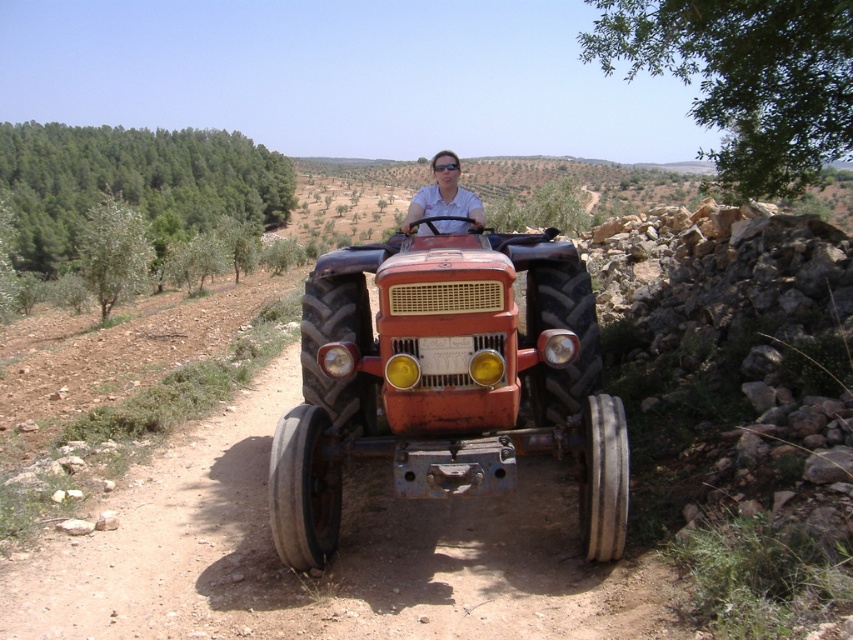
From the picture: Is rustic metal tractor at center smaller than matte white shirt at center?

No, rustic metal tractor at center is not smaller than matte white shirt at center.

Based on the photo, can you confirm if rustic metal tractor at center is positioned below matte white shirt at center?

Yes.

Locate an element on the screen. This screenshot has width=853, height=640. rustic metal tractor at center is located at coordinates (445, 384).

How much distance is there between dirt track at center and matte white shirt at center?

11.50 feet

Is dirt track at center positioned before matte white shirt at center?

Yes, dirt track at center is closer to the viewer.

Who is more distant from viewer, (527, 609) or (416, 205)?

Positioned behind is point (416, 205).

The height and width of the screenshot is (640, 853). I want to click on dirt track at center, so click(332, 557).

Can you confirm if dirt track at center is positioned to the left of rustic metal tractor at center?

Yes, dirt track at center is to the left of rustic metal tractor at center.

Which is behind, point (271, 368) or point (598, 416)?

The point (271, 368) is behind.

Image resolution: width=853 pixels, height=640 pixels. I want to click on dirt track at center, so click(x=332, y=557).